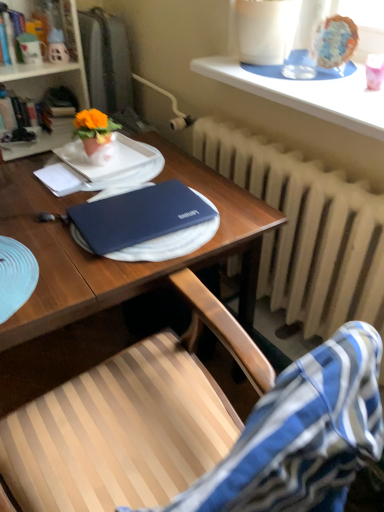
Question: Does point (357, 39) appear closer or farther from the camera than point (54, 81)?

Choices:
 (A) farther
 (B) closer

Answer: (B)

Question: Considering the positions of glazed ceramic cake at upper right and white matte bookshelf at upper left in the image, is glazed ceramic cake at upper right taller or shorter than white matte bookshelf at upper left?

Choices:
 (A) tall
 (B) short

Answer: (B)

Question: Considering the real-world distances, which object is closest to the white matte bookshelf at upper left?

Choices:
 (A) matte orange flowerpot at upper left
 (B) white paper at left
 (C) matte ceramic mug at upper left
 (D) wooden at lower left
 (E) glazed ceramic cake at upper right

Answer: (C)

Question: Which is nearer to the wooden at lower left?

Choices:
 (A) glazed ceramic cake at upper right
 (B) white matte bookshelf at upper left
 (C) matte ceramic gnome at upper left, which ranks as the 2th toy in left-to-right order
 (D) blue matte laptop at center
 (E) white textured radiator at center

Answer: (D)